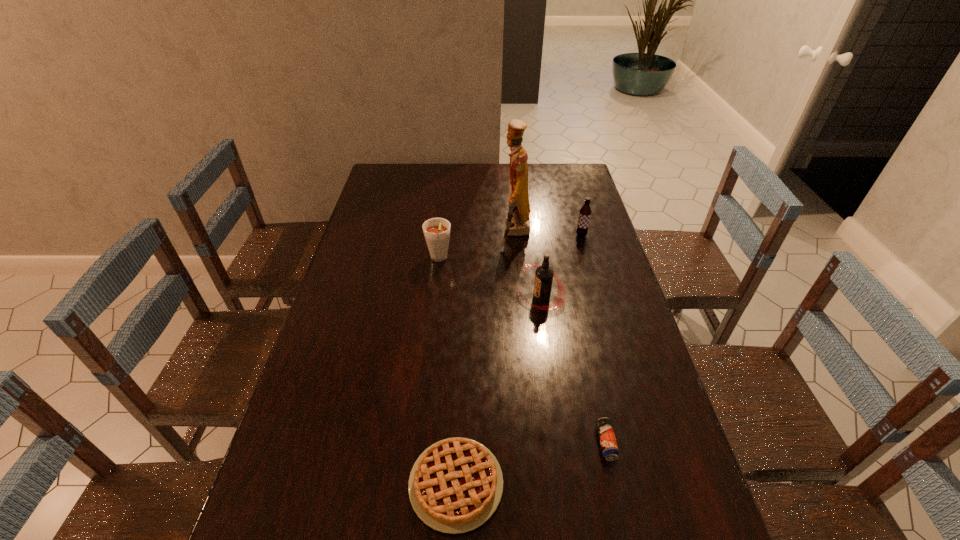
This screenshot has height=540, width=960. Identify the location of the tallest object. (518, 222).

You are a GUI agent. You are given a task and a screenshot of the screen. Output one action in this format:
    pyautogui.click(x=<x>, y=<y>)
    Task: Click on the second root beer from left to right
    
    Given the screenshot: What is the action you would take?
    pyautogui.click(x=544, y=273)

In order to click on the third nearest object in this screenshot , I will do `click(544, 273)`.

Locate an element on the screen. The image size is (960, 540). the leftmost root beer is located at coordinates (436, 231).

This screenshot has width=960, height=540. Identify the location of the rightmost object. (585, 212).

Identify the location of the rightmost root beer. This screenshot has height=540, width=960. (585, 212).

The image size is (960, 540). I want to click on pie, so click(455, 485).

Locate an element on the screen. beer can is located at coordinates (609, 447).

Image resolution: width=960 pixels, height=540 pixels. In order to click on free spot located 0.360m on the front-facing side of the tallest object in this screenshot , I will do 401,234.

At what (x,y) coordinates should I click in order to perform the action: click on vacant region located 0.120m on the front-facing side of the tallest object. Please return your answer as a coordinate pair (x, y). The image size is (960, 540). Looking at the image, I should click on (467, 234).